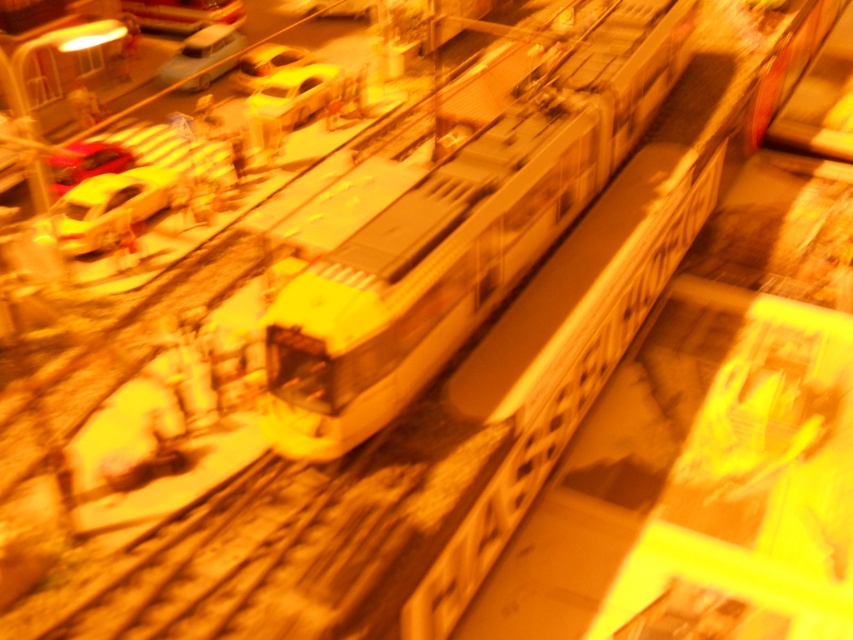
You are a pedestrian standing at the edge of the railway tracks. You see the white glossy train at center and the shiny yellow car at upper center. Which object is positioned to the right side from your viewpoint?

The white glossy train at center is positioned to the right of the shiny yellow car at upper center from your viewpoint.

You are standing at the point marked by the coordinate point (85,163) in the image. What object is located at this coordinate?

The point (85,163) marks the location of the metallic red car at left.